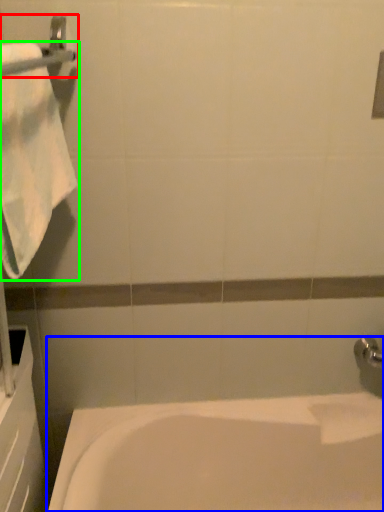
Question: Which object is the farthest from towel bar (highlighted by a red box)? Choose among these: bathtub (highlighted by a blue box) or towel (highlighted by a green box).

Choices:
 (A) bathtub
 (B) towel

Answer: (A)